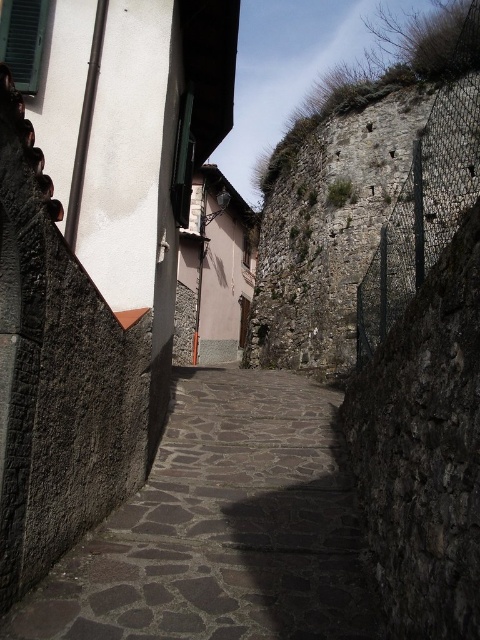
You are a tourist walking along the narrow cobblestone street and want to take a photo of the stone paved path at center and the rough stone wall at upper right. Which object should you focus on first to ensure both are in the frame?

The stone paved path at center is positioned on the left side of the rough stone wall at upper right, so you should focus on the rough stone wall at upper right first to ensure both are in the frame since it is on the right side and the path is to its left.

You are a delivery person carrying a large package and need to walk along the stone paved path at center. Considering the size of the path compared to the rough stone wall at upper right, do you think the path will be wide enough for you to pass safely?

The stone paved path at center is smaller than the rough stone wall at upper right. Since the path is narrower than the wall, it might be tight for carrying a large package, but as long as you stay centered and move slowly, you should be able to pass safely.